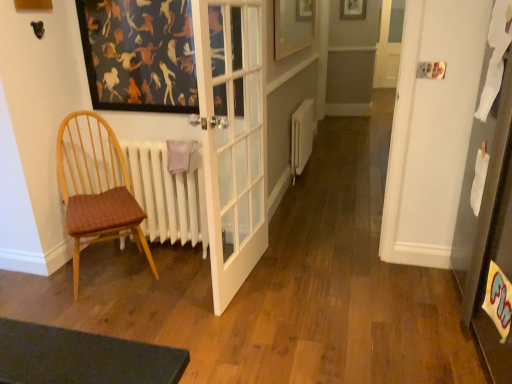
Image resolution: width=512 pixels, height=384 pixels. I want to click on free location to the right of woven fabric chair at left, so click(176, 287).